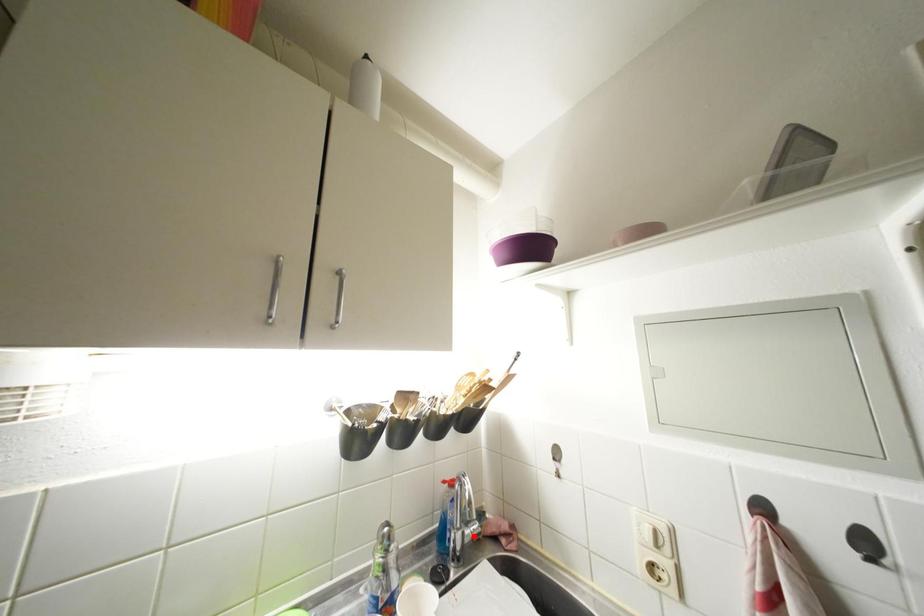
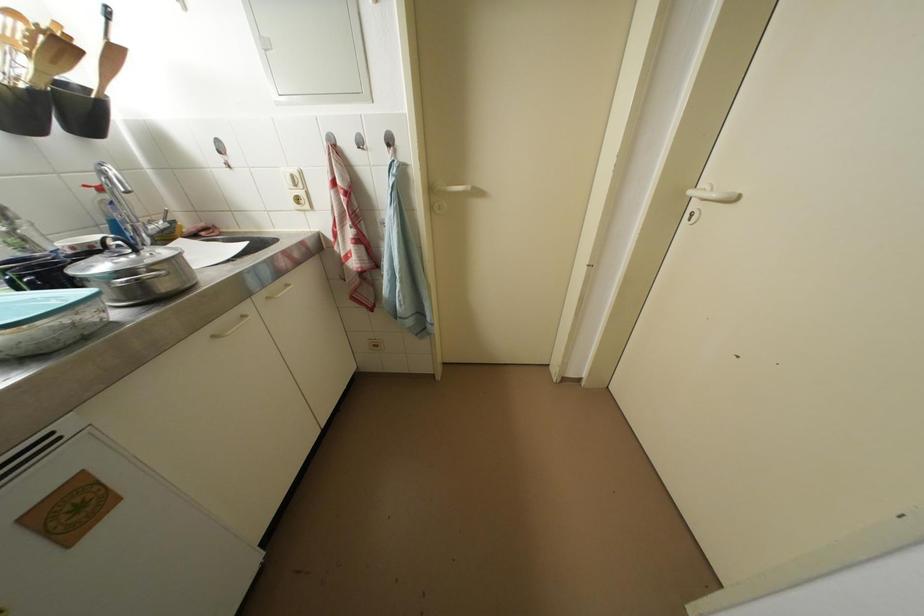
In the second image, find the point that corresponds to the highlighted location in the first image.

(157, 231)